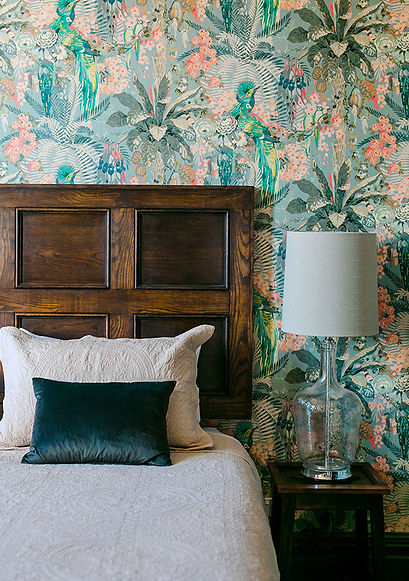
This screenshot has height=581, width=409. Identify the location of headboard. (189, 259).